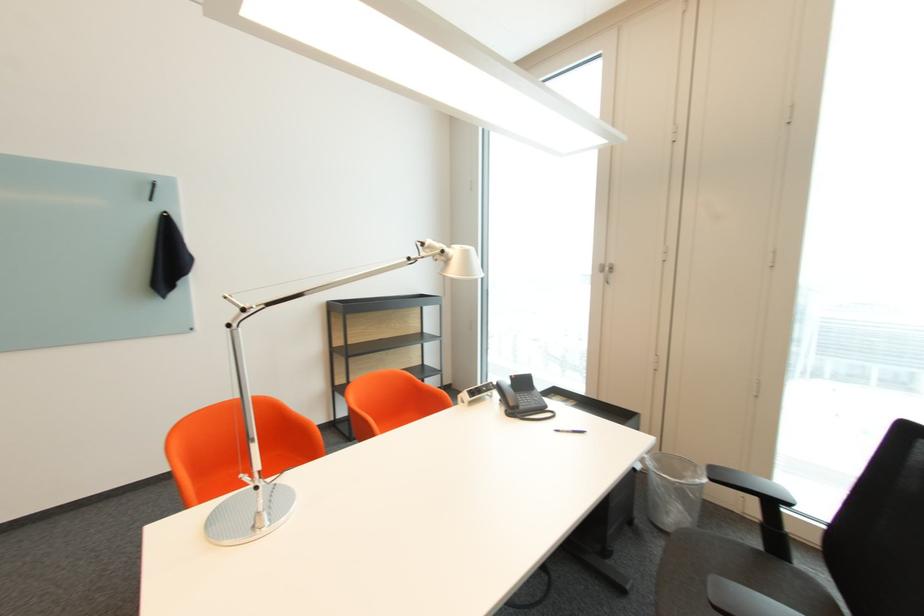
Where would you press the telephone button? Please return your answer as a coordinate pair (x, y).

(530, 400)